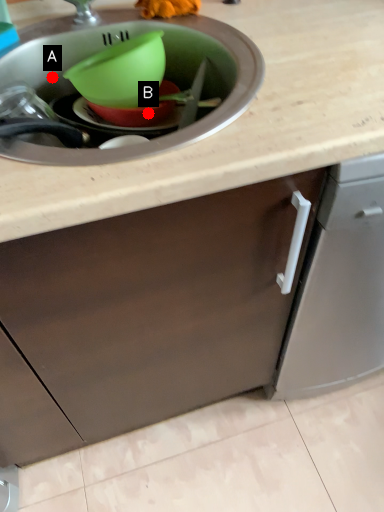
Question: Two points are circled on the image, labeled by A and B beside each circle. Which point is closer to the camera taking this photo?

Choices:
 (A) A is closer
 (B) B is closer

Answer: (B)